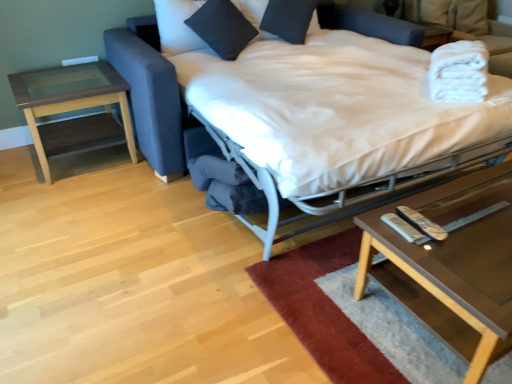
Question: From a real-world perspective, is clear glass coffee table at lower right positioned above or below black cotton pillow at upper center, arranged as the first pillow when viewed from the left?

Choices:
 (A) below
 (B) above

Answer: (A)

Question: In terms of height, does clear glass coffee table at lower right look taller or shorter compared to black cotton pillow at upper center, which is counted as the second pillow, starting from the right?

Choices:
 (A) tall
 (B) short

Answer: (B)

Question: Considering the real-world distances, which object is closest to the white soft towels at upper right?

Choices:
 (A) brown wood/glass side table at left
 (B) black matte pillow at upper center, acting as the first pillow starting from the right
 (C) clear glass coffee table at lower right
 (D) black cotton pillow at upper center, arranged as the first pillow when viewed from the left
 (E) white plastic remote at lower right, marked as the 1th remote in a right-to-left arrangement

Answer: (C)

Question: Based on their relative distances, which object is nearer to the white fabric bed at center?

Choices:
 (A) black matte pillow at upper center, acting as the first pillow starting from the right
 (B) white soft towels at upper right
 (C) black cotton pillow at upper center, arranged as the first pillow when viewed from the left
 (D) clear glass coffee table at lower right
 (E) white plastic remote at lower right, the 2th remote in the left-to-right sequence

Answer: (C)